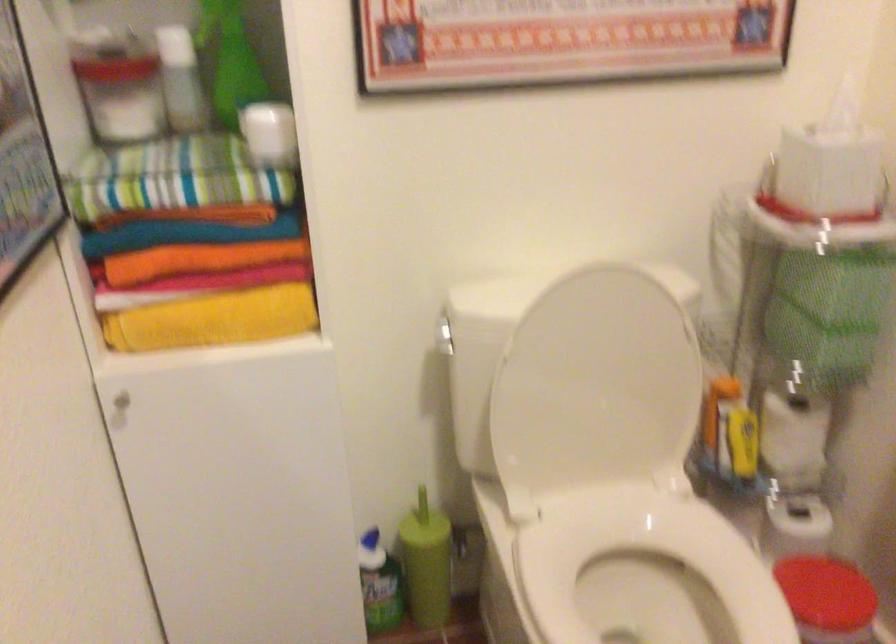
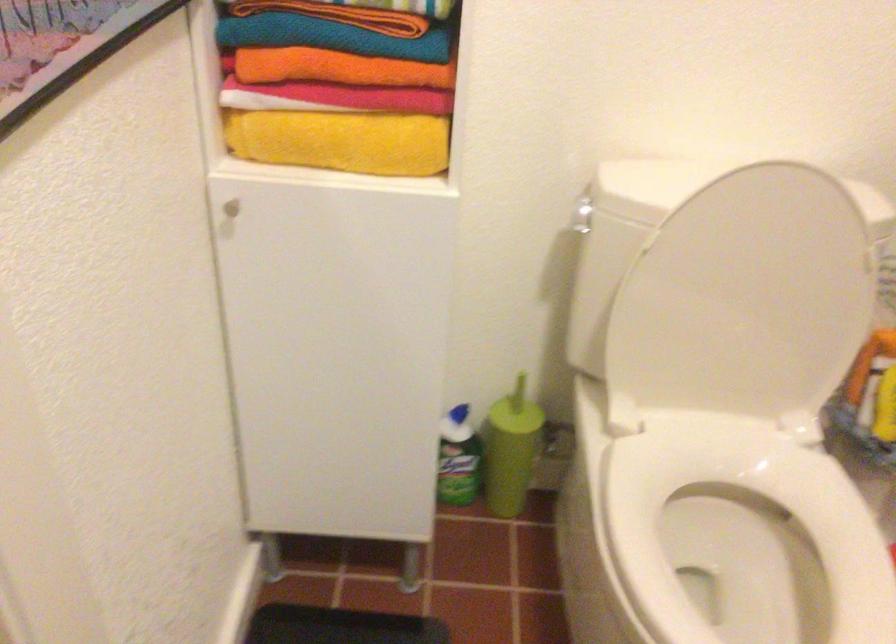
The point at (599,383) is marked in the first image. Where is the corresponding point in the second image?

(744, 299)